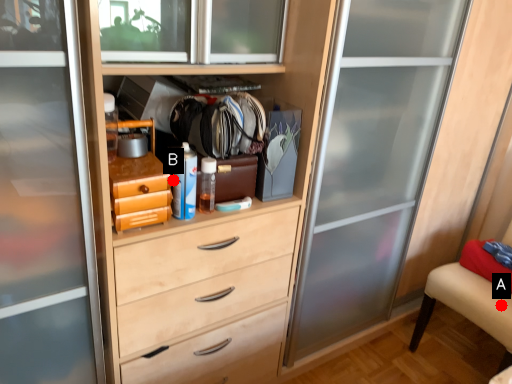
Question: Two points are circled on the image, labeled by A and B beside each circle. Which point is farther to the camera?

Choices:
 (A) A is further
 (B) B is further

Answer: (A)